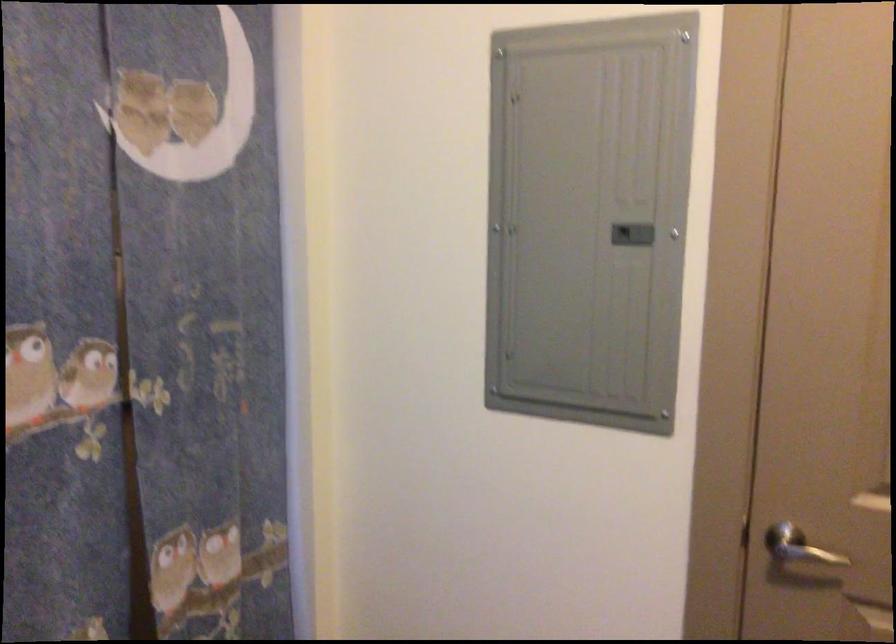
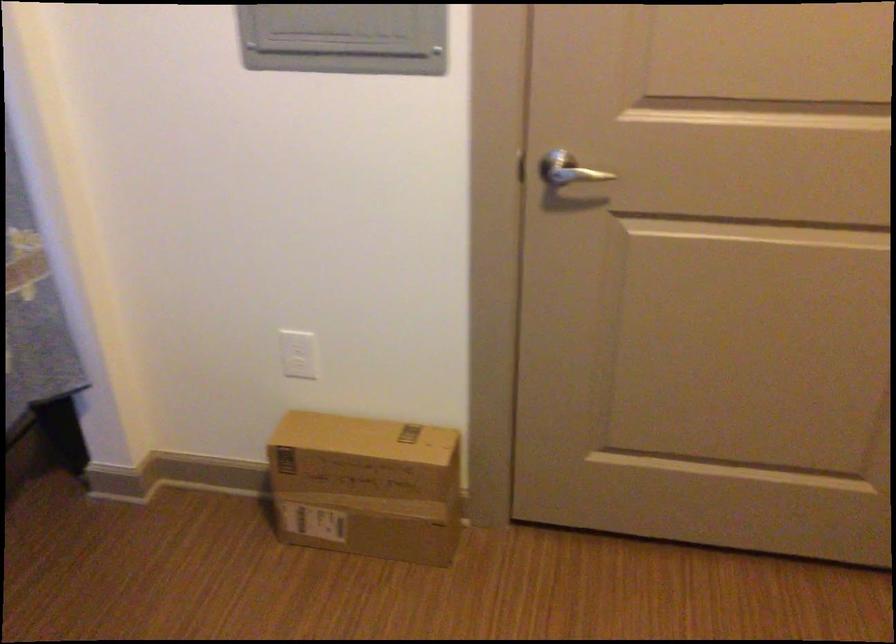
Question: How did the camera likely rotate?

Choices:
 (A) Left
 (B) Right
 (C) Up
 (D) Down

Answer: (D)